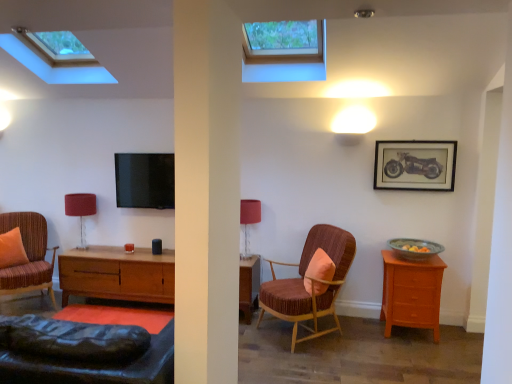
Find the location of a particular element. The width and height of the screenshot is (512, 384). vacant area to the right of velvet-like brown armchair at center, which is the second chair in left-to-right order is located at coordinates (385, 345).